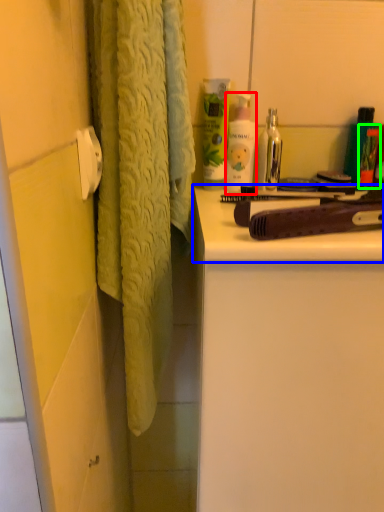
Question: Estimate the real-world distances between objects in this image. Which object is closer to toiletry (highlighted by a red box), counter top (highlighted by a blue box) or toiletry (highlighted by a green box)?

Choices:
 (A) counter top
 (B) toiletry

Answer: (B)